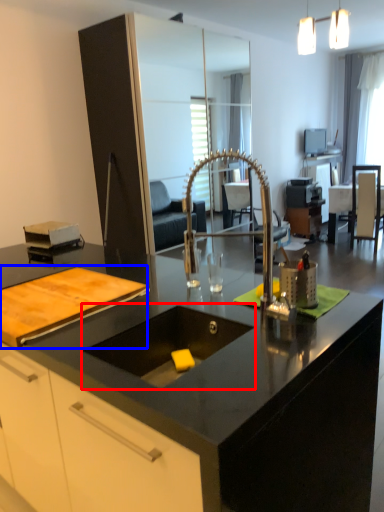
Question: Which point is further to the camera, sink (highlighted by a red box) or cutting board (highlighted by a blue box)?

Choices:
 (A) sink
 (B) cutting board

Answer: (B)